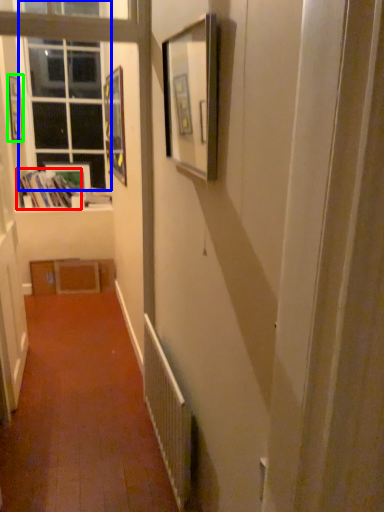
Question: Estimate the real-world distances between objects in this image. Which object is farther from book (highlighted by a red box), window (highlighted by a blue box) or picture frame (highlighted by a green box)?

Choices:
 (A) window
 (B) picture frame

Answer: (B)